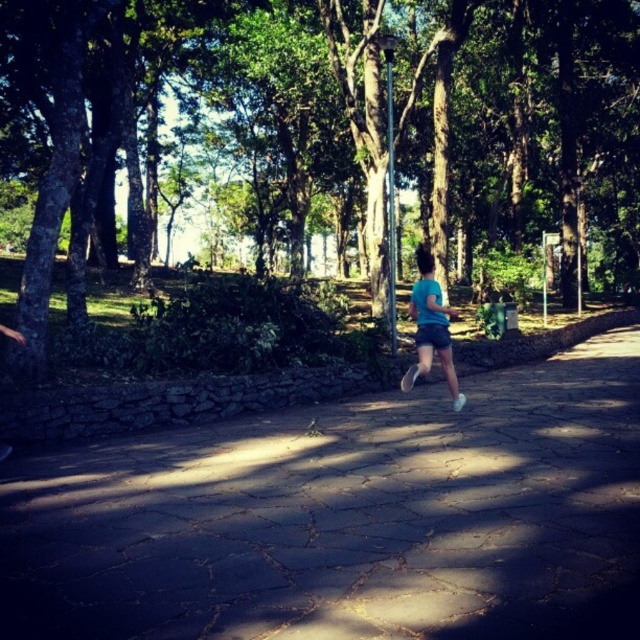
Question: Does green leafy tree at center appear on the right side of blue matte shorts at center?

Choices:
 (A) no
 (B) yes

Answer: (A)

Question: Which object is farther from the camera taking this photo?

Choices:
 (A) paved stone path at center
 (B) blue matte shorts at center
 (C) green leafy tree at center

Answer: (C)

Question: Does paved stone path at center appear under blue matte shorts at center?

Choices:
 (A) no
 (B) yes

Answer: (B)

Question: Is paved stone path at center smaller than blue matte shorts at center?

Choices:
 (A) yes
 (B) no

Answer: (A)

Question: Which object is the closest to the blue matte shorts at center?

Choices:
 (A) paved stone path at center
 (B) green leafy tree at center

Answer: (A)

Question: Which point is farther to the camera?

Choices:
 (A) paved stone path at center
 (B) blue matte shorts at center
 (C) green leafy tree at center

Answer: (C)